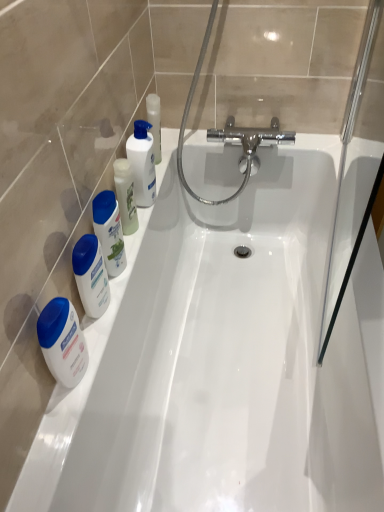
Describe the element at coordinates (125, 195) in the screenshot. The image size is (384, 512). I see `white glossy mouthwash at left, placed as the 1th mouthwash when sorted from top to bottom` at that location.

How much space does white glossy bottle at upper left, placed as the first cleaning product when sorted from back to front, occupy vertically?

It is 9.15 inches.

You are a GUI agent. You are given a task and a screenshot of the screen. Output one action in this format:
    pyautogui.click(x=<x>, y=<y>)
    Task: Click on the white glossy mouthwash at left, acting as the 2th mouthwash starting from the top
    Image resolution: width=384 pixels, height=512 pixels.
    Given the screenshot: What is the action you would take?
    pyautogui.click(x=109, y=231)

Which is more to the left, white glossy mouthwash at left, placed as the 1th mouthwash when sorted from top to bottom, or white glossy lotion at left, the 3th mouthwash viewed from the top?

white glossy lotion at left, the 3th mouthwash viewed from the top, is more to the left.

Between point (123, 169) and point (74, 346), which one is positioned in front?

Positioned in front is point (74, 346).

Could you tell me if white glossy mouthwash at left, positioned as the 3th mouthwash in bottom-to-top order, is turned towards white glossy lotion at left, the 1th mouthwash positioned from the bottom?

No, white glossy mouthwash at left, positioned as the 3th mouthwash in bottom-to-top order, is not turned towards white glossy lotion at left, the 1th mouthwash positioned from the bottom.

Does point (115, 250) appear closer or farther from the camera than point (135, 172)?

Point (115, 250) is closer to the camera than point (135, 172).

From a real-world perspective, is white glossy mouthwash at left, acting as the 2th mouthwash starting from the top, above or below white glossy bottle at upper left, the 1th cleaning product from the right?

white glossy mouthwash at left, acting as the 2th mouthwash starting from the top, is situated lower than white glossy bottle at upper left, the 1th cleaning product from the right, in the real world.

Consider the image. Is white glossy mouthwash at left, acting as the 2th mouthwash starting from the top, oriented away from white glossy bottle at upper left, the 1th cleaning product from the right?

white glossy mouthwash at left, acting as the 2th mouthwash starting from the top, is not turned away from white glossy bottle at upper left, the 1th cleaning product from the right.

Considering their positions, is white glossy mouthwash at left, acting as the 2th mouthwash starting from the top, located in front of or behind white glossy bottle at upper left, the 2th cleaning product when ordered from left to right?

In the image, white glossy mouthwash at left, acting as the 2th mouthwash starting from the top, appears in front of white glossy bottle at upper left, the 2th cleaning product when ordered from left to right.

From the picture: From the image's perspective, who appears lower, white glossy mouthwash at left, acting as the 2th mouthwash starting from the top, or white glossy mouthwash at left, positioned as the 3th mouthwash in bottom-to-top order?

white glossy mouthwash at left, acting as the 2th mouthwash starting from the top, from the image's perspective.

Is white glossy mouthwash at left, acting as the 2th mouthwash starting from the top, not near white glossy mouthwash at left, placed as the 1th mouthwash when sorted from top to bottom?

No, there isn't a large distance between white glossy mouthwash at left, acting as the 2th mouthwash starting from the top, and white glossy mouthwash at left, placed as the 1th mouthwash when sorted from top to bottom.

Is white glossy mouthwash at left, which is the second mouthwash from bottom to top, turned away from white glossy mouthwash at left, positioned as the 3th mouthwash in bottom-to-top order?

No, white glossy mouthwash at left, positioned as the 3th mouthwash in bottom-to-top order, is not at the back of white glossy mouthwash at left, which is the second mouthwash from bottom to top.

Is white glossy lotion at left, the 3th mouthwash viewed from the top, inside the boundaries of white glossy lotion at left, acting as the first cleaning product starting from the left, or outside?

white glossy lotion at left, the 3th mouthwash viewed from the top, cannot be found inside white glossy lotion at left, acting as the first cleaning product starting from the left.

Which of these two, white glossy lotion at left, the 3th mouthwash viewed from the top, or white glossy lotion at left, acting as the first cleaning product starting from the left, stands taller?

Standing taller between the two is white glossy lotion at left, the 3th mouthwash viewed from the top.

Who is bigger, white glossy lotion at left, the 1th mouthwash positioned from the bottom, or white glossy lotion at left, which is counted as the second cleaning product, starting from the right?

white glossy lotion at left, which is counted as the second cleaning product, starting from the right, is bigger.

From a real-world perspective, is white glossy lotion at left, the 1th mouthwash positioned from the bottom, physically above white glossy lotion at left, which is the first cleaning product from front to back?

No, from a real-world perspective, white glossy lotion at left, the 1th mouthwash positioned from the bottom, is not above white glossy lotion at left, which is the first cleaning product from front to back.

In the scene shown: Is white glossy mouthwash at left, positioned as the 3th mouthwash in bottom-to-top order, further to camera compared to white glossy lotion at left, which is the 2th cleaning product in top-to-bottom order?

Yes, white glossy mouthwash at left, positioned as the 3th mouthwash in bottom-to-top order, is behind white glossy lotion at left, which is the 2th cleaning product in top-to-bottom order.

From the picture: In the image, is white glossy mouthwash at left, positioned as the 3th mouthwash in bottom-to-top order, on the left side or the right side of white glossy lotion at left, acting as the first cleaning product starting from the left?

In the image, white glossy mouthwash at left, positioned as the 3th mouthwash in bottom-to-top order, appears on the right side of white glossy lotion at left, acting as the first cleaning product starting from the left.

From the image's perspective, starting from the white glossy lotion at left, which is the first cleaning product from front to back, which mouthwash is the 2nd one above? Please provide its 2D coordinates.

[(125, 195)]

Looking at their sizes, would you say white glossy mouthwash at left, positioned as the 3th mouthwash in bottom-to-top order, is wider or thinner than white glossy lotion at left, which is the 2th cleaning product in top-to-bottom order?

In the image, white glossy mouthwash at left, positioned as the 3th mouthwash in bottom-to-top order, appears to be more narrow than white glossy lotion at left, which is the 2th cleaning product in top-to-bottom order.

Is white glossy lotion at left, the 1th mouthwash positioned from the bottom, in front of or behind white glossy bottle at upper left, which ranks as the second cleaning product in bottom-to-top order, in the image?

white glossy lotion at left, the 1th mouthwash positioned from the bottom, is in front of white glossy bottle at upper left, which ranks as the second cleaning product in bottom-to-top order.

Is white glossy lotion at left, the 3th mouthwash viewed from the top, bigger than white glossy bottle at upper left, which ranks as the second cleaning product in bottom-to-top order?

Actually, white glossy lotion at left, the 3th mouthwash viewed from the top, might be smaller than white glossy bottle at upper left, which ranks as the second cleaning product in bottom-to-top order.

Considering the sizes of objects white glossy lotion at left, the 1th mouthwash positioned from the bottom, and white glossy bottle at upper left, which ranks as the 2th cleaning product in front-to-back order, in the image provided, who is shorter, white glossy lotion at left, the 1th mouthwash positioned from the bottom, or white glossy bottle at upper left, which ranks as the 2th cleaning product in front-to-back order,?

white glossy lotion at left, the 1th mouthwash positioned from the bottom, is shorter.

Looking at this image, is white glossy lotion at left, which is the 2th cleaning product in top-to-bottom order, directly adjacent to white glossy lotion at left, the 3th mouthwash viewed from the top?

No, white glossy lotion at left, which is the 2th cleaning product in top-to-bottom order, is not touching white glossy lotion at left, the 3th mouthwash viewed from the top.

Measure the distance from white glossy lotion at left, which ranks as the 2th cleaning product in back-to-front order, to white glossy lotion at left, the 3th mouthwash viewed from the top.

4.75 inches.

Is the position of white glossy lotion at left, which ranks as the 2th cleaning product in back-to-front order, more distant than that of white glossy lotion at left, the 3th mouthwash viewed from the top?

Yes.

Looking at this image, which is more to the right, white glossy lotion at left, which ranks as the 2th cleaning product in back-to-front order, or white glossy lotion at left, the 1th mouthwash positioned from the bottom?

white glossy lotion at left, which ranks as the 2th cleaning product in back-to-front order.

The image size is (384, 512). What are the coordinates of `the 2nd mouthwash counting from the right side of the white glossy lotion at left, the 1th mouthwash positioned from the bottom` in the screenshot? It's located at (125, 195).

Where is `cleaning product located behind the white glossy mouthwash at left, acting as the 2th mouthwash starting from the top`? The image size is (384, 512). cleaning product located behind the white glossy mouthwash at left, acting as the 2th mouthwash starting from the top is located at coordinates (142, 163).

Based on their spatial positions, is white glossy mouthwash at left, which is the second mouthwash from bottom to top, or white glossy lotion at left, which is the first cleaning product from front to back, closer to white glossy bottle at upper left, placed as the first cleaning product when sorted from back to front?

The object closer to white glossy bottle at upper left, placed as the first cleaning product when sorted from back to front, is white glossy mouthwash at left, which is the second mouthwash from bottom to top.

Considering their positions, is white glossy lotion at left, acting as the first cleaning product starting from the left, positioned further to white glossy mouthwash at left, placed as the 1th mouthwash when sorted from top to bottom, than white glossy mouthwash at left, which is the second mouthwash from bottom to top?

Among the two, white glossy lotion at left, acting as the first cleaning product starting from the left, is located further to white glossy mouthwash at left, placed as the 1th mouthwash when sorted from top to bottom.

Which object lies nearer to the anchor point white glossy lotion at left, the 3th mouthwash viewed from the top, white glossy mouthwash at left, acting as the 2th mouthwash starting from the top, or white glossy mouthwash at left, positioned as the 3th mouthwash in bottom-to-top order?

white glossy mouthwash at left, acting as the 2th mouthwash starting from the top.

Based on their spatial positions, is white glossy lotion at left, which is the 2th cleaning product in top-to-bottom order, or white glossy lotion at left, the 1th mouthwash positioned from the bottom, further from white glossy bottle at upper left, placed as the first cleaning product when sorted from top to bottom?

Among the two, white glossy lotion at left, the 1th mouthwash positioned from the bottom, is located further to white glossy bottle at upper left, placed as the first cleaning product when sorted from top to bottom.

Estimate the real-world distances between objects in this image. Which object is closer to white glossy lotion at left, which is the first cleaning product from front to back, white glossy bottle at upper left, the 2th cleaning product when ordered from left to right, or white glossy mouthwash at left, positioned as the 3th mouthwash in bottom-to-top order?

white glossy mouthwash at left, positioned as the 3th mouthwash in bottom-to-top order.

From the image, which object appears to be nearer to white glossy mouthwash at left, which is the second mouthwash from bottom to top, white glossy bottle at upper left, the 2th cleaning product when ordered from left to right, or white glossy lotion at left, which is the first cleaning product from front to back?

white glossy lotion at left, which is the first cleaning product from front to back, is positioned closer to the anchor white glossy mouthwash at left, which is the second mouthwash from bottom to top.

Which object lies further to the anchor point white glossy mouthwash at left, acting as the 2th mouthwash starting from the top, white glossy mouthwash at left, positioned as the 3th mouthwash in bottom-to-top order, or white glossy lotion at left, the 1th mouthwash positioned from the bottom?

white glossy lotion at left, the 1th mouthwash positioned from the bottom, is further to white glossy mouthwash at left, acting as the 2th mouthwash starting from the top.

Considering their positions, is white glossy lotion at left, the 1th mouthwash positioned from the bottom, positioned further to white glossy lotion at left, which ranks as the 2th cleaning product in back-to-front order, than white glossy bottle at upper left, the 2th cleaning product when ordered from left to right?

white glossy bottle at upper left, the 2th cleaning product when ordered from left to right, lies further to white glossy lotion at left, which ranks as the 2th cleaning product in back-to-front order, than the other object.

Identify the location of mouthwash that lies between white glossy bottle at upper left, which ranks as the 2th cleaning product in front-to-back order, and white glossy mouthwash at left, acting as the 2th mouthwash starting from the top, from top to bottom. The height and width of the screenshot is (512, 384). (125, 195).

At what (x,y) coordinates should I click in order to perform the action: click on mouthwash between white glossy mouthwash at left, positioned as the 3th mouthwash in bottom-to-top order, and white glossy lotion at left, the 3th mouthwash viewed from the top, in the up-down direction. Please return your answer as a coordinate pair (x, y). The width and height of the screenshot is (384, 512). Looking at the image, I should click on (109, 231).

This screenshot has height=512, width=384. What are the coordinates of `cleaning product between white glossy mouthwash at left, which is the second mouthwash from bottom to top, and white glossy lotion at left, the 3th mouthwash viewed from the top, in the up-down direction` in the screenshot? It's located at (91, 275).

The height and width of the screenshot is (512, 384). Find the location of `cleaning product between white glossy mouthwash at left, placed as the 1th mouthwash when sorted from top to bottom, and white glossy lotion at left, the 3th mouthwash viewed from the top, from top to bottom`. cleaning product between white glossy mouthwash at left, placed as the 1th mouthwash when sorted from top to bottom, and white glossy lotion at left, the 3th mouthwash viewed from the top, from top to bottom is located at coordinates (91, 275).